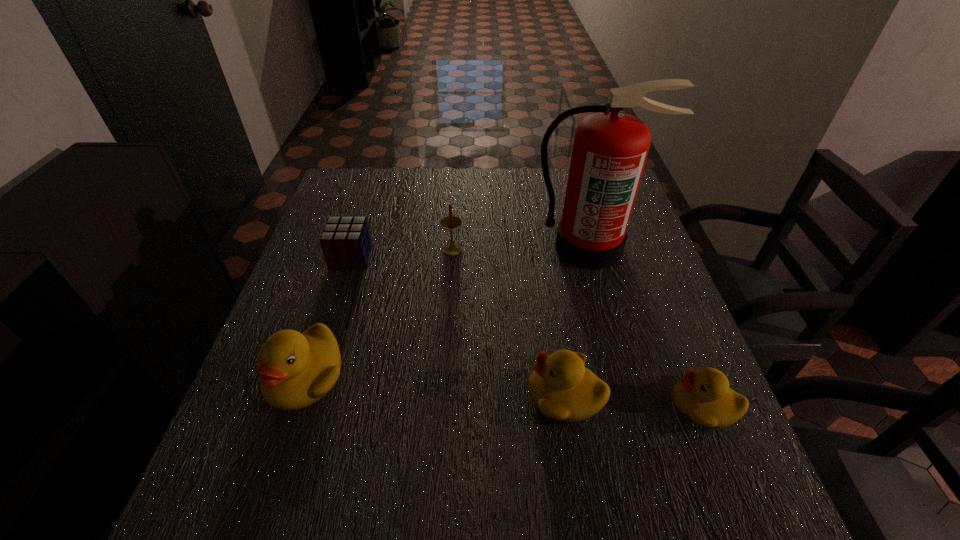
To achieve even spacing by inserting another duckling among them, please point to a vacant spot for this new duckling. Please provide its 2D coordinates. Your answer should be formatted as a tuple, i.e. [(x, y)], where the tuple contains the x and y coordinates of a point satisfying the conditions above.

[(433, 384)]